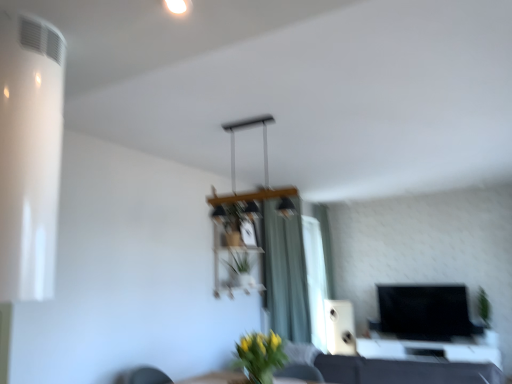
Question: Is green leafy plant at right, arranged as the first plant when viewed from the right, further to the viewer compared to green matte vase at lower center?

Choices:
 (A) no
 (B) yes

Answer: (B)

Question: Can you confirm if green leafy plant at right, which is the 2th plant from left to right, is shorter than green matte vase at lower center?

Choices:
 (A) no
 (B) yes

Answer: (A)

Question: Is green leafy plant at right, arranged as the first plant when viewed from the right, wider than green matte vase at lower center?

Choices:
 (A) yes
 (B) no

Answer: (A)

Question: Could you tell me if green leafy plant at right, the first plant viewed from the back, is turned towards green matte vase at lower center?

Choices:
 (A) yes
 (B) no

Answer: (B)

Question: Is green leafy plant at right, the first plant viewed from the back, far away from green matte vase at lower center?

Choices:
 (A) yes
 (B) no

Answer: (A)

Question: Is green leafy plant at right, which is the 2th plant from left to right, placed right next to green matte vase at lower center?

Choices:
 (A) no
 (B) yes

Answer: (A)

Question: Is yellow matte vase at center, positioned as the 2th plant in back-to-front order, bigger than white matte speaker at center?

Choices:
 (A) yes
 (B) no

Answer: (B)

Question: From a real-world perspective, is yellow matte vase at center, acting as the 1th plant starting from the front, positioned under white matte speaker at center based on gravity?

Choices:
 (A) yes
 (B) no

Answer: (B)

Question: Can you confirm if yellow matte vase at center, acting as the 1th plant starting from the front, is positioned to the left of white matte speaker at center?

Choices:
 (A) no
 (B) yes

Answer: (B)

Question: Is yellow matte vase at center, the 2th plant from the right, positioned behind white matte speaker at center?

Choices:
 (A) no
 (B) yes

Answer: (A)

Question: Does yellow matte vase at center, marked as the 1th plant in a top-to-bottom arrangement, have a lesser width compared to white matte speaker at center?

Choices:
 (A) yes
 (B) no

Answer: (A)

Question: Is yellow matte vase at center, marked as the 1th plant in a top-to-bottom arrangement, looking in the opposite direction of white matte speaker at center?

Choices:
 (A) yes
 (B) no

Answer: (B)

Question: Is green matte vase at lower center closer to camera compared to green fabric curtain at center, which appears as the second curtain when viewed from the back?

Choices:
 (A) no
 (B) yes

Answer: (B)